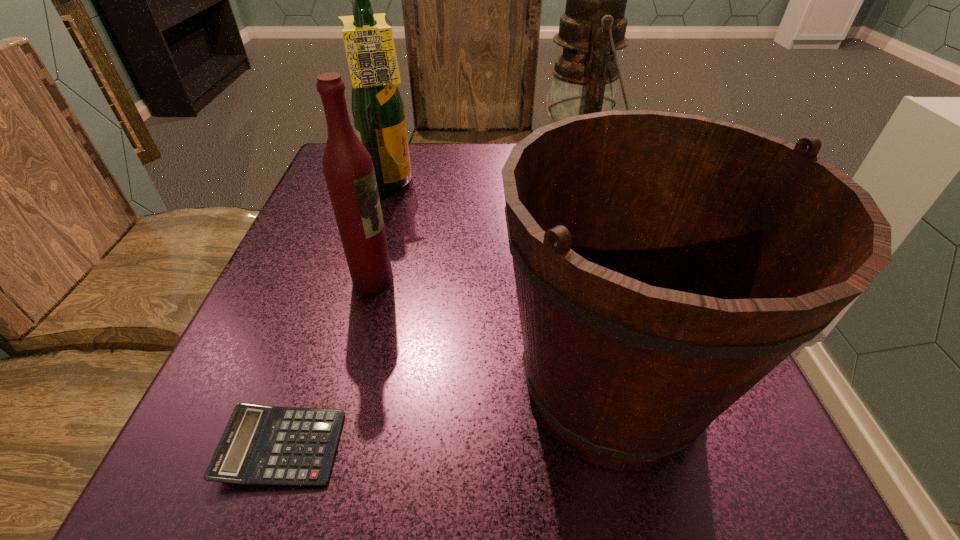
Find the location of a particular element. Image resolution: width=960 pixels, height=540 pixels. vacant space located on the right of the calculator is located at coordinates (489, 447).

You are a GUI agent. You are given a task and a screenshot of the screen. Output one action in this format:
    pyautogui.click(x=<x>, y=<y>)
    Task: Click on the lantern located in the far edge section of the desktop
    The width and height of the screenshot is (960, 540).
    Given the screenshot: What is the action you would take?
    click(x=593, y=27)

The image size is (960, 540). Find the location of `liquor that is at the far edge`. liquor that is at the far edge is located at coordinates (377, 107).

In order to click on bucket located in the near edge section of the desktop in this screenshot , I will do `click(665, 263)`.

You are a GUI agent. You are given a task and a screenshot of the screen. Output one action in this format:
    pyautogui.click(x=<x>, y=<y>)
    Task: Click on the calculator that is at the near edge
    
    Given the screenshot: What is the action you would take?
    pyautogui.click(x=261, y=445)

Where is `calculator present at the left edge`? calculator present at the left edge is located at coordinates (261, 445).

Identify the location of lantern situated at the right edge. (593, 27).

I want to click on bucket at the right edge, so click(x=665, y=263).

The height and width of the screenshot is (540, 960). Identify the location of object positioned at the far left corner. (377, 107).

Locate an element on the screen. The image size is (960, 540). object situated at the near left corner is located at coordinates (261, 445).